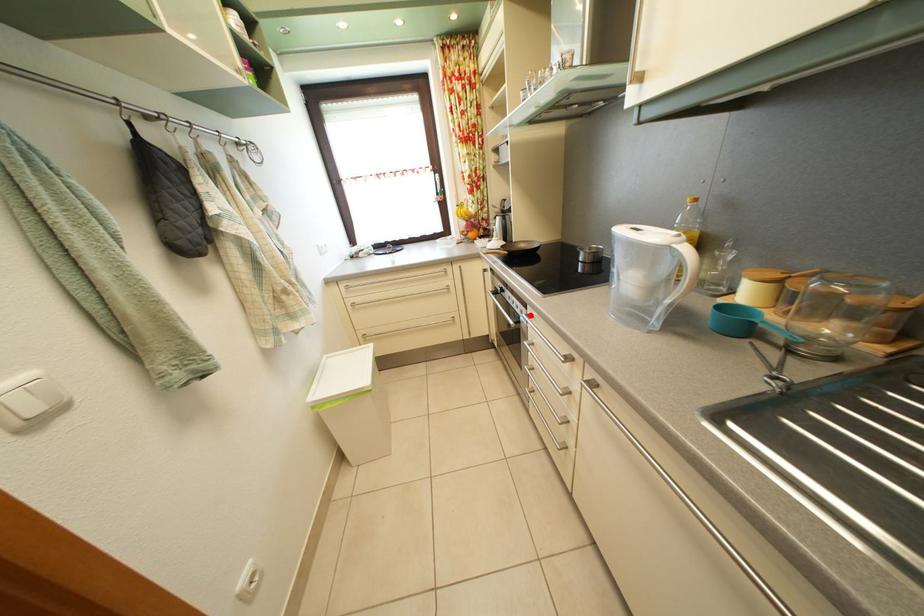
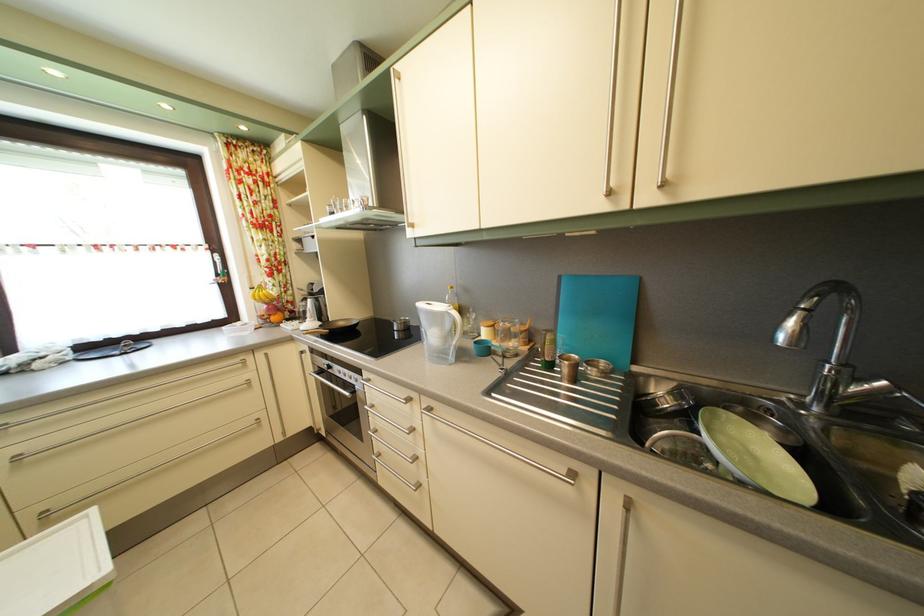
The point at the highlighted location is marked in the first image. Where is the corresponding point in the second image?

(365, 384)